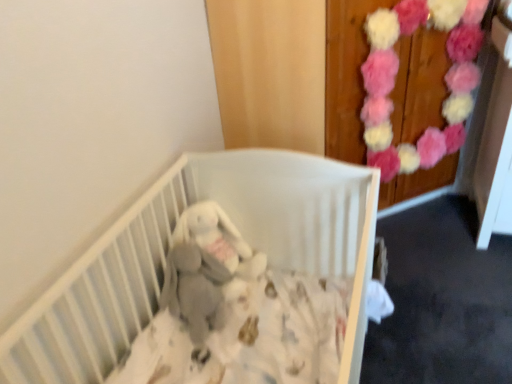
Question: From a real-world perspective, is gray plush baby elephant at center physically located above or below puffy fabric flowers at upper right?

Choices:
 (A) below
 (B) above

Answer: (A)

Question: In terms of height, does gray plush baby elephant at center look taller or shorter compared to puffy fabric flowers at upper right?

Choices:
 (A) tall
 (B) short

Answer: (B)

Question: Which object is the closest to the gray plush baby elephant at center?

Choices:
 (A) puffy fabric flowers at upper right
 (B) white matte crib at center

Answer: (B)

Question: Which object is the closest to the white matte crib at center?

Choices:
 (A) gray plush baby elephant at center
 (B) puffy fabric flowers at upper right

Answer: (A)